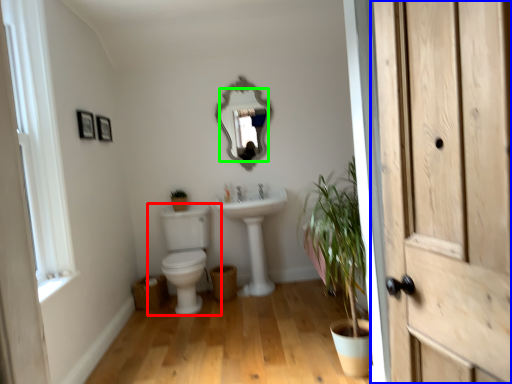
Question: Which is nearer to the toilet (highlighted by a red box)? door (highlighted by a blue box) or mirror (highlighted by a green box).

Choices:
 (A) door
 (B) mirror

Answer: (B)